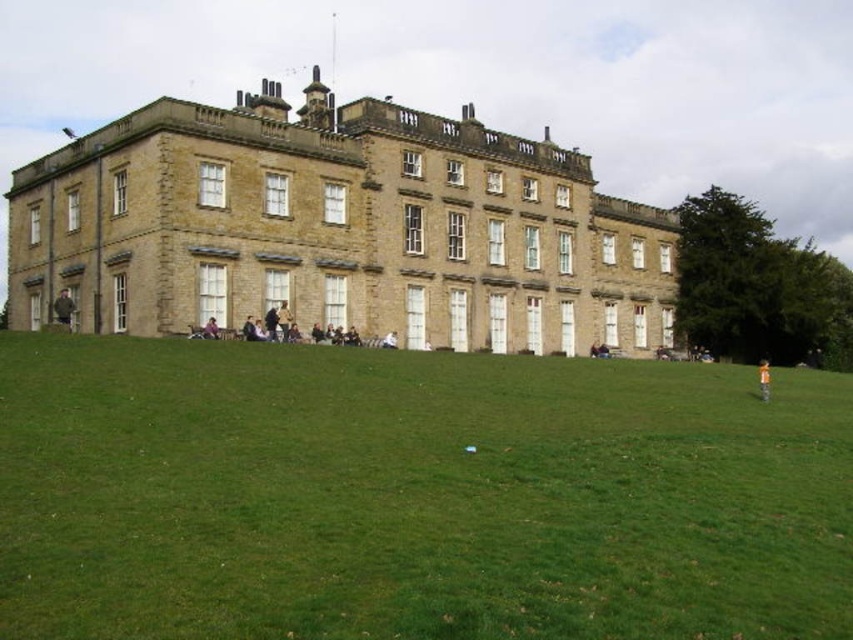
You are planning to host a picnic and need to decide where to place a picnic basket. You have two options on the lawn in front of the mansion. One spot is on the green grass at lower center, and the other is near the dark brown leather jacket at lower left. Which location offers more space for spreading out the picnic blanket?

The green grass at lower center is larger in size than the dark brown leather jacket at lower left, so the green grass at lower center offers more space for spreading out the picnic blanket.

You are a photographer planning to take a group photo of the dark brown leather jacket at lower left and the dark purple shirt at center. The camera you are using has a limited depth of field that can only focus on one object at a time. Which object should you focus on to ensure the one farther away is still somewhat in focus?

You should focus on the dark brown leather jacket at lower left because it is larger in size than the dark purple shirt at center, meaning it is closer to the camera. By focusing on the closer object, the farther one will still be somewhat in focus.

You are standing at the point with coordinates (62, 307) in front of the historic stone building. What object is located exactly at that point?

The dark brown leather jacket at lower left is located exactly at point (62, 307).